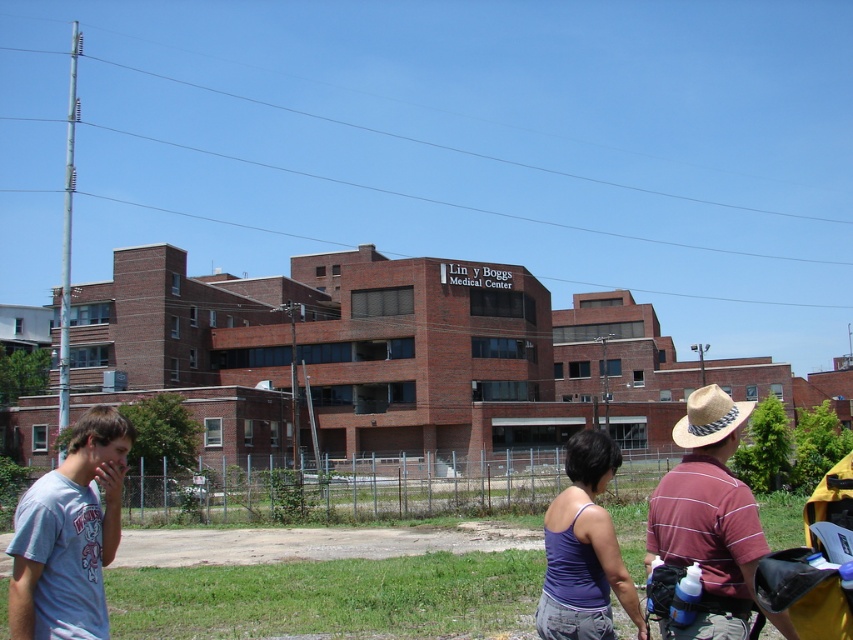
Question: Does light blue t-shirt at left come in front of maroon striped shirt at lower right?

Choices:
 (A) yes
 (B) no

Answer: (B)

Question: Does light blue t-shirt at left have a larger size compared to maroon striped shirt at lower right?

Choices:
 (A) no
 (B) yes

Answer: (A)

Question: Is light blue t-shirt at left in front of maroon striped shirt at lower right?

Choices:
 (A) yes
 (B) no

Answer: (B)

Question: Among these points, which one is nearest to the camera?

Choices:
 (A) [x=663, y=506]
 (B) [x=106, y=410]

Answer: (A)

Question: Among these objects, which one is farthest from the camera?

Choices:
 (A) maroon striped shirt at lower right
 (B) light blue t-shirt at left

Answer: (B)

Question: Which point is closer to the camera taking this photo?

Choices:
 (A) (80, 625)
 (B) (705, 460)

Answer: (A)